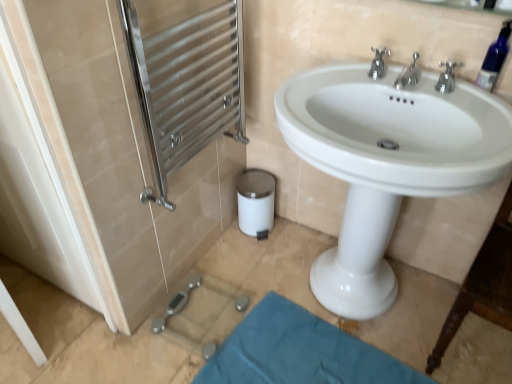
The height and width of the screenshot is (384, 512). In order to click on vacant area that is in front of silver metallic faucet at upper right, the 1th tap from the right in this screenshot , I will do `click(469, 115)`.